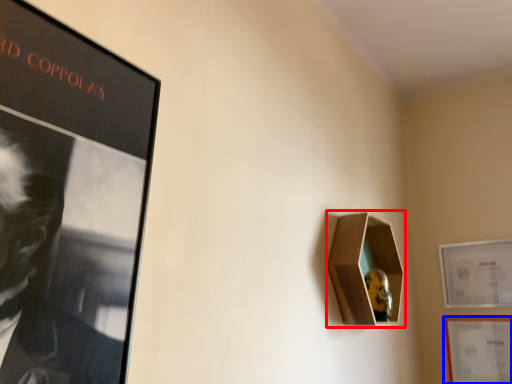
Question: Which object is closer to the camera taking this photo, cabinet (highlighted by a red box) or picture frame (highlighted by a blue box)?

Choices:
 (A) cabinet
 (B) picture frame

Answer: (A)